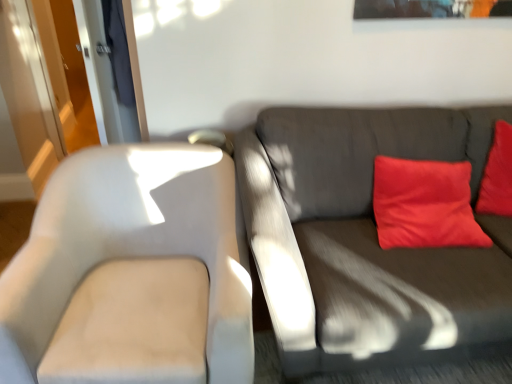
Question: From the image's perspective, is matte red pillow at upper right located above dark gray fabric couch at right?

Choices:
 (A) yes
 (B) no

Answer: (A)

Question: Does matte red pillow at upper right have a smaller size compared to dark gray fabric couch at right?

Choices:
 (A) yes
 (B) no

Answer: (A)

Question: Can you confirm if matte red pillow at upper right is shorter than dark gray fabric couch at right?

Choices:
 (A) no
 (B) yes

Answer: (B)

Question: Can you confirm if matte red pillow at upper right is thinner than dark gray fabric couch at right?

Choices:
 (A) yes
 (B) no

Answer: (A)

Question: Is matte red pillow at upper right in contact with dark gray fabric couch at right?

Choices:
 (A) yes
 (B) no

Answer: (B)

Question: In the image, is dark gray fabric couch at right positioned in front of or behind transparent glass door at upper left?

Choices:
 (A) front
 (B) behind

Answer: (A)

Question: From a real-world perspective, is dark gray fabric couch at right positioned above or below transparent glass door at upper left?

Choices:
 (A) above
 (B) below

Answer: (B)

Question: In terms of width, does dark gray fabric couch at right look wider or thinner when compared to transparent glass door at upper left?

Choices:
 (A) wide
 (B) thin

Answer: (A)

Question: Considering the positions of dark gray fabric couch at right and transparent glass door at upper left in the image, is dark gray fabric couch at right taller or shorter than transparent glass door at upper left?

Choices:
 (A) tall
 (B) short

Answer: (A)

Question: Is matte red pillow at upper right spatially inside transparent glass door at upper left, or outside of it?

Choices:
 (A) inside
 (B) outside

Answer: (B)

Question: Is point (440, 226) closer or farther from the camera than point (92, 52)?

Choices:
 (A) farther
 (B) closer

Answer: (B)

Question: From the image's perspective, is matte red pillow at upper right above or below transparent glass door at upper left?

Choices:
 (A) above
 (B) below

Answer: (B)

Question: In terms of height, does matte red pillow at upper right look taller or shorter compared to transparent glass door at upper left?

Choices:
 (A) short
 (B) tall

Answer: (A)

Question: Is point click(x=103, y=89) positioned closer to the camera than point click(x=468, y=225)?

Choices:
 (A) farther
 (B) closer

Answer: (A)

Question: Is transparent glass door at upper left bigger or smaller than matte red pillow at upper right?

Choices:
 (A) big
 (B) small

Answer: (B)